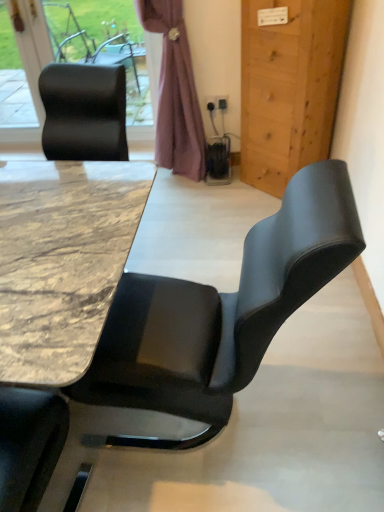
Question: From a real-world perspective, is marble/black at center under purple fabric curtain at upper center?

Choices:
 (A) yes
 (B) no

Answer: (A)

Question: Is marble/black at center wider than purple fabric curtain at upper center?

Choices:
 (A) no
 (B) yes

Answer: (B)

Question: Is marble/black at center oriented away from purple fabric curtain at upper center?

Choices:
 (A) no
 (B) yes

Answer: (A)

Question: From the image's perspective, is marble/black at center below purple fabric curtain at upper center?

Choices:
 (A) no
 (B) yes

Answer: (B)

Question: From the image's perspective, is marble/black at center on top of purple fabric curtain at upper center?

Choices:
 (A) no
 (B) yes

Answer: (A)

Question: Looking at their shapes, would you say marble/black at center is wider or thinner than black leather chair at upper left?

Choices:
 (A) thin
 (B) wide

Answer: (B)

Question: Visually, is marble/black at center positioned to the left or to the right of black leather chair at upper left?

Choices:
 (A) right
 (B) left

Answer: (A)

Question: Is marble/black at center situated inside black leather chair at upper left or outside?

Choices:
 (A) outside
 (B) inside

Answer: (A)

Question: In terms of size, does marble/black at center appear bigger or smaller than black leather chair at upper left?

Choices:
 (A) small
 (B) big

Answer: (B)

Question: From a real-world perspective, is purple fabric curtain at upper center above or below marble/black at center?

Choices:
 (A) below
 (B) above

Answer: (B)

Question: Considering their positions, is purple fabric curtain at upper center located in front of or behind marble/black at center?

Choices:
 (A) behind
 (B) front

Answer: (A)

Question: Looking at their shapes, would you say purple fabric curtain at upper center is wider or thinner than marble/black at center?

Choices:
 (A) wide
 (B) thin

Answer: (B)

Question: Is purple fabric curtain at upper center situated inside marble/black at center or outside?

Choices:
 (A) inside
 (B) outside

Answer: (B)

Question: In terms of width, does marble/black at center look wider or thinner when compared to purple fabric curtain at upper center?

Choices:
 (A) wide
 (B) thin

Answer: (A)

Question: From a real-world perspective, is marble/black at center physically located above or below purple fabric curtain at upper center?

Choices:
 (A) below
 (B) above

Answer: (A)